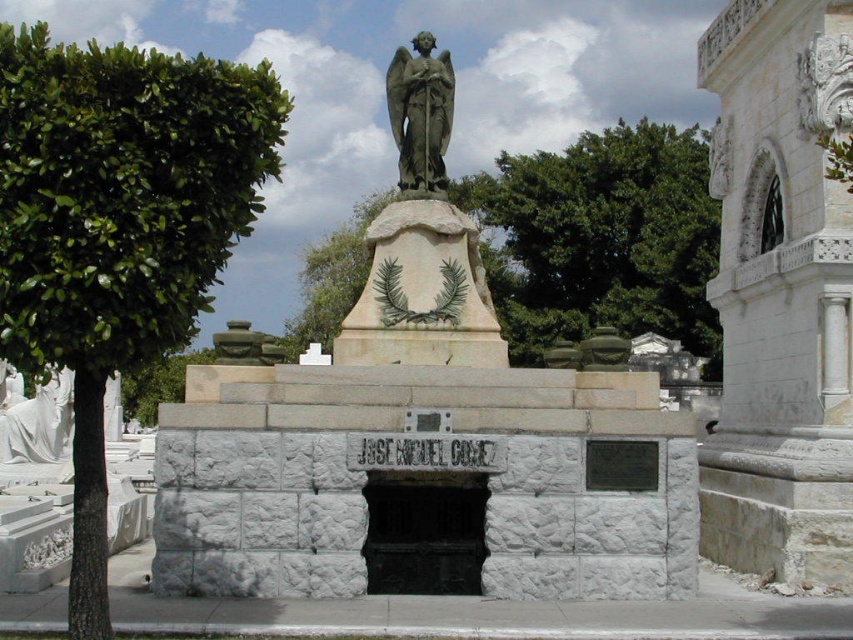
The width and height of the screenshot is (853, 640). What do you see at coordinates (119, 227) in the screenshot? I see `green leafy tree at left` at bounding box center [119, 227].

Who is positioned more to the right, green leafy tree at left or green stone angel at center?

From the viewer's perspective, green stone angel at center appears more on the right side.

Between point (225, 115) and point (390, 116), which one is positioned behind?

Positioned behind is point (390, 116).

The image size is (853, 640). In order to click on green leafy tree at left in this screenshot , I will do `click(119, 227)`.

Can you confirm if green leafy tree at upper center is positioned to the left of matte stone angel at center?

Incorrect, green leafy tree at upper center is not on the left side of matte stone angel at center.

Is green leafy tree at upper center further to camera compared to matte stone angel at center?

Yes, green leafy tree at upper center is behind matte stone angel at center.

Image resolution: width=853 pixels, height=640 pixels. Find the location of `green leafy tree at upper center`. green leafy tree at upper center is located at coordinates (602, 237).

Can you confirm if green leafy tree at left is positioned to the right of green leafy tree at upper center?

Incorrect, green leafy tree at left is not on the right side of green leafy tree at upper center.

Who is more distant from viewer, (x=231, y=90) or (x=535, y=240)?

Positioned behind is point (x=535, y=240).

Does point (35, 323) lie behind point (618, 170)?

No.

Find the location of a particular element. This screenshot has height=640, width=853. green leafy tree at left is located at coordinates tap(119, 227).